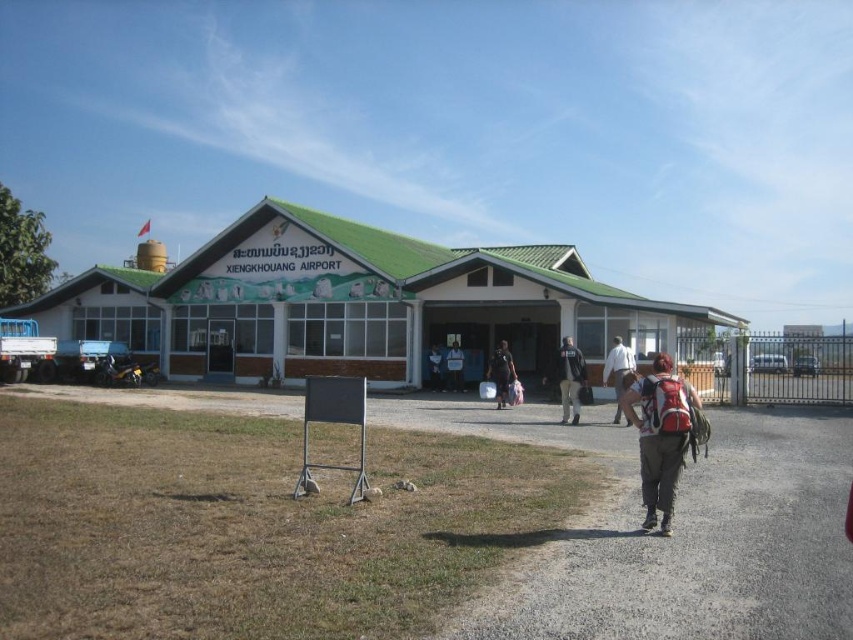
Question: Among these objects, which one is farthest from the camera?

Choices:
 (A) dark gray backpack at center
 (B) light brown leather pants at center
 (C) dark blue shirt at center
 (D) red backpack at lower right

Answer: (C)

Question: Which object is closer to the camera taking this photo?

Choices:
 (A) light brown leather pants at center
 (B) dark gray backpack at center

Answer: (A)

Question: Can you confirm if black fabric backpack at center is wider than light brown leather pants at center?

Choices:
 (A) yes
 (B) no

Answer: (B)

Question: Does light brown leather pants at center have a greater width compared to blue fabric shirt at center?

Choices:
 (A) no
 (B) yes

Answer: (B)

Question: Which point appears closest to the camera in this image?

Choices:
 (A) (445, 385)
 (B) (433, 346)
 (C) (561, 406)
 (D) (502, 346)

Answer: (C)

Question: Does red backpack at lower right have a lesser width compared to dark gray backpack at center?

Choices:
 (A) yes
 (B) no

Answer: (A)